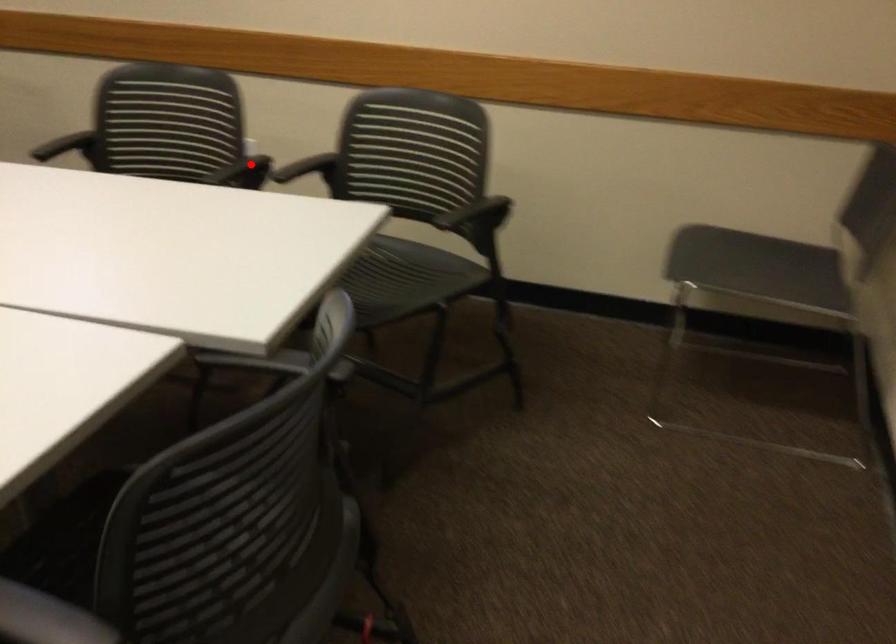
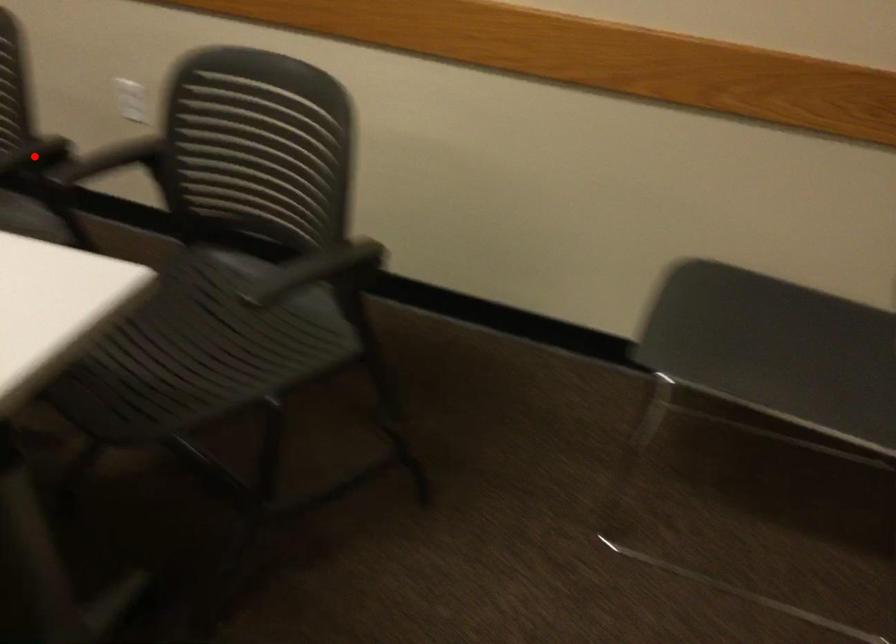
I am providing you with two images of the same scene from different viewpoints. A red point is marked on the first image and another point is marked on the second image. Do the highlighted points in image1 and image2 indicate the same real-world spot?

Yes